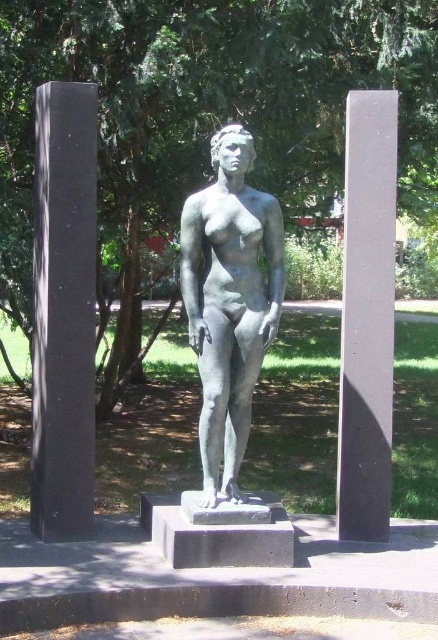
You are an art student analyzing the composition of the statue and its surroundings. Based on the scene, which object is positioned higher in the image, the black polished stone pillar at left or the polished bronze statue at center?

The black polished stone pillar at left is located above the polished bronze statue at center, meaning it is positioned higher in the image.

You are standing in a park and see the bronze statue of a nude female figure between two pillars. Which pillar, the black polished stone pillar at left or the other pillar, is closer to you?

The black polished stone pillar at left is closer to you at 16.48 feet from the viewer, so it is closer than the other pillar.

You are standing in the park and want to take a photo of the bronze statue of a nude female figure. To ensure both the statue and the black polished stone pillar at left are in the frame, where should you position yourself relative to the pillars?

You should position yourself to the right of the black polished stone pillar at left to include both the statue and the pillar in the frame.